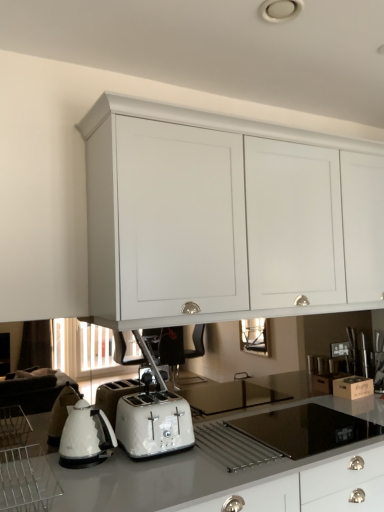
I want to click on free space in front of white glossy kettle at lower left, so click(84, 480).